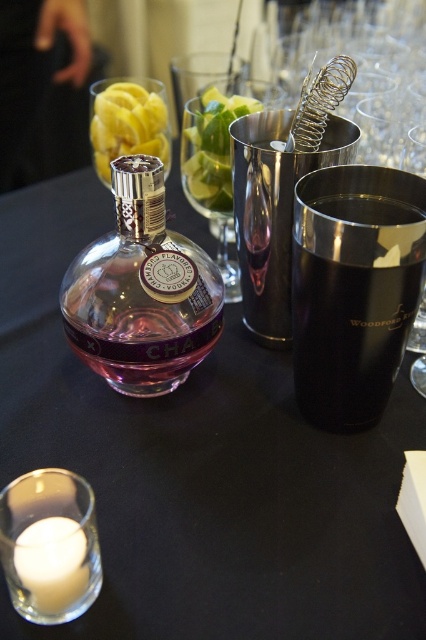
You are a bartender preparing a drink and need to choose a lemon that fits into a narrow glass. Which lemon between the green matte lemon at center and the yellow matte lemon at upper left would you select?

The green matte lemon at center is thinner than the yellow matte lemon at upper left, so it would fit better into a narrow glass.

What is located at the coordinates point (141, 291)?

The pink glass bottle at center is located at point (141, 291).

You are a bartender preparing a drink and need to place a yellow matte lemon at upper left and a white wax candle at lower left on the bar. The minimum distance required between items is 12 inches for safety. Can you safely place them at their current positions?

The yellow matte lemon at upper left is 13.76 inches away from the white wax candle at lower left. Since 13.76 inches exceeds the 12 inch minimum requirement, they can be safely placed at their current positions.